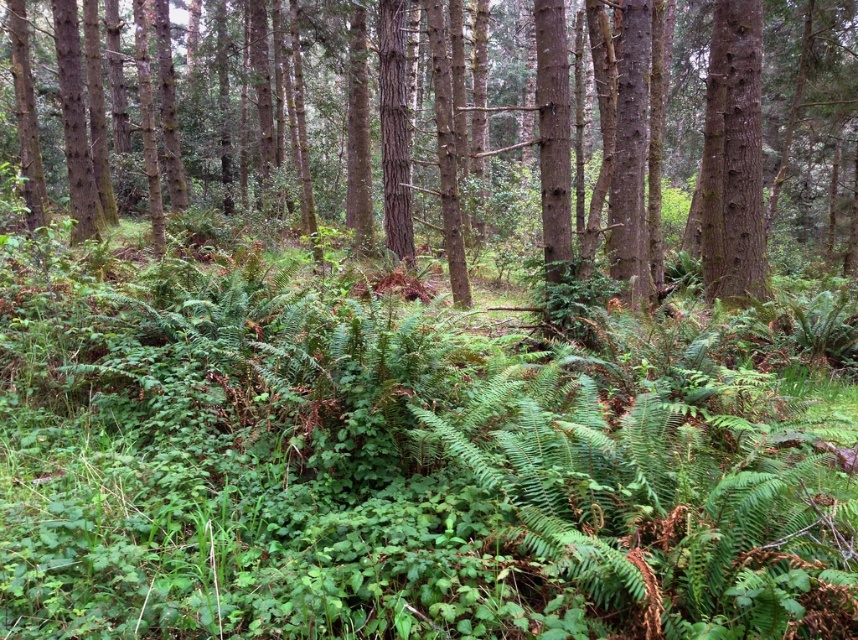
Who is lower down, smooth bark tree at center or smooth brown tree trunk at upper right?

smooth brown tree trunk at upper right is lower down.

Does smooth bark tree at center appear on the right side of smooth brown tree trunk at upper right?

Incorrect, smooth bark tree at center is not on the right side of smooth brown tree trunk at upper right.

Which is behind, point (278, 209) or point (760, 182)?

Positioned behind is point (278, 209).

The height and width of the screenshot is (640, 858). I want to click on smooth bark tree at center, so click(532, 141).